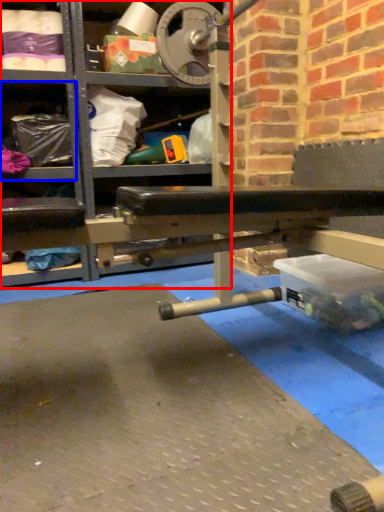
Question: Which of the following is the farthest to the observer, shelf (highlighted by a red box) or shelf (highlighted by a blue box)?

Choices:
 (A) shelf
 (B) shelf

Answer: (B)